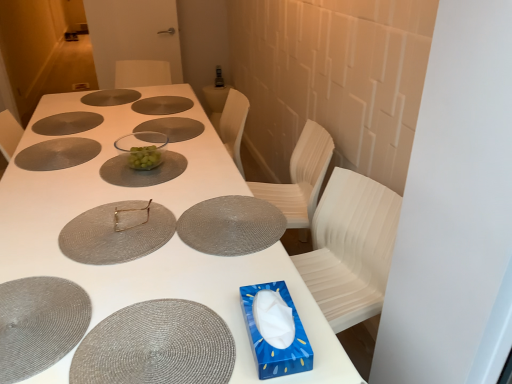
At what (x,y) coordinates should I click in order to perform the action: click on vacant space underneath matte gray glass plate at upper left, the third glass plate in the back-to-front sequence (from a real-world perspective). Please return your answer as a coordinate pair (x, y). Looking at the image, I should click on (64, 117).